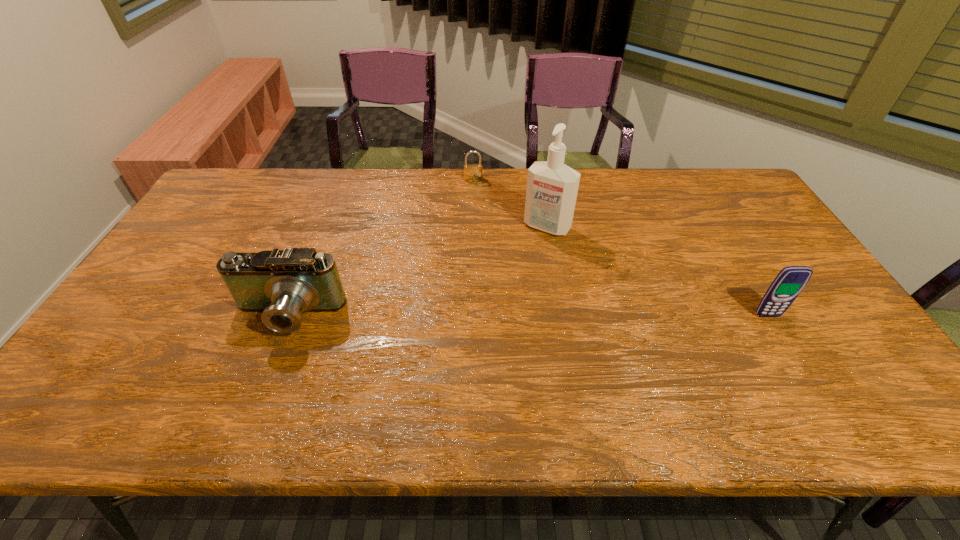
At what (x,y) coordinates should I click in order to perform the action: click on free space located on the front label of the tallest object. Please return your answer as a coordinate pair (x, y). This screenshot has width=960, height=540. Looking at the image, I should click on pos(517,264).

In order to click on vacant position located on the front-facing side of the farthest object in this screenshot , I will do `click(492, 253)`.

Where is `vacant region located 0.290m on the front-facing side of the farthest object`? vacant region located 0.290m on the front-facing side of the farthest object is located at coordinates (487, 232).

Where is `free space located on the front-facing side of the farthest object`? free space located on the front-facing side of the farthest object is located at coordinates (484, 222).

At what (x,y) coordinates should I click in order to perform the action: click on object present at the far edge. Please return your answer as a coordinate pair (x, y). Looking at the image, I should click on (472, 172).

The height and width of the screenshot is (540, 960). I want to click on object positioned at the right edge, so click(x=790, y=281).

Where is `vacant position at the far edge of the desktop`? vacant position at the far edge of the desktop is located at coordinates (667, 184).

Identify the location of vacant area at the near edge. The image size is (960, 540). (491, 368).

Identify the location of vacant area at the left edge of the desktop. (201, 289).

In the image, there is a desktop. Where is `vacant area at the near right corner`? vacant area at the near right corner is located at coordinates coord(849,355).